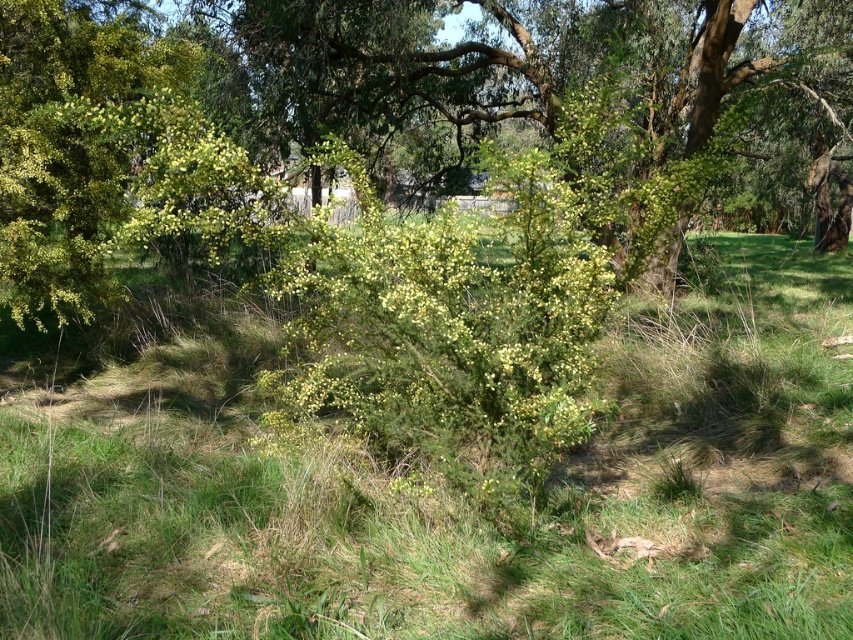
Question: Which object is closer to the camera taking this photo?

Choices:
 (A) green leafy bush at center
 (B) green grassy at center

Answer: (B)

Question: Which of the following is the closest to the observer?

Choices:
 (A) green grassy at center
 (B) green leafy bush at center

Answer: (A)

Question: Which of the following is the farthest from the observer?

Choices:
 (A) (94, 593)
 (B) (285, 8)

Answer: (B)

Question: Does green grassy at center have a smaller size compared to green leafy bush at center?

Choices:
 (A) no
 (B) yes

Answer: (B)

Question: Can you confirm if green grassy at center is positioned to the left of green leafy bush at center?

Choices:
 (A) no
 (B) yes

Answer: (B)

Question: Does green grassy at center have a greater width compared to green leafy bush at center?

Choices:
 (A) no
 (B) yes

Answer: (A)